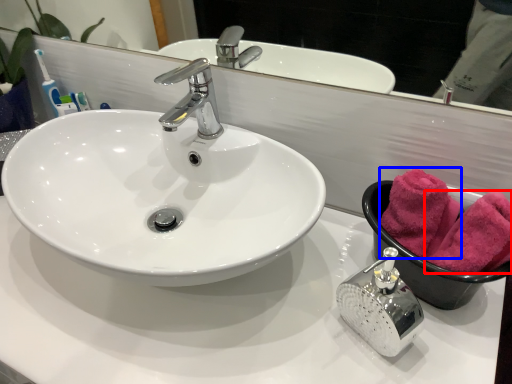
Question: Which object appears farthest to the camera in this image, bath towel (highlighted by a red box) or bath towel (highlighted by a blue box)?

Choices:
 (A) bath towel
 (B) bath towel

Answer: (B)